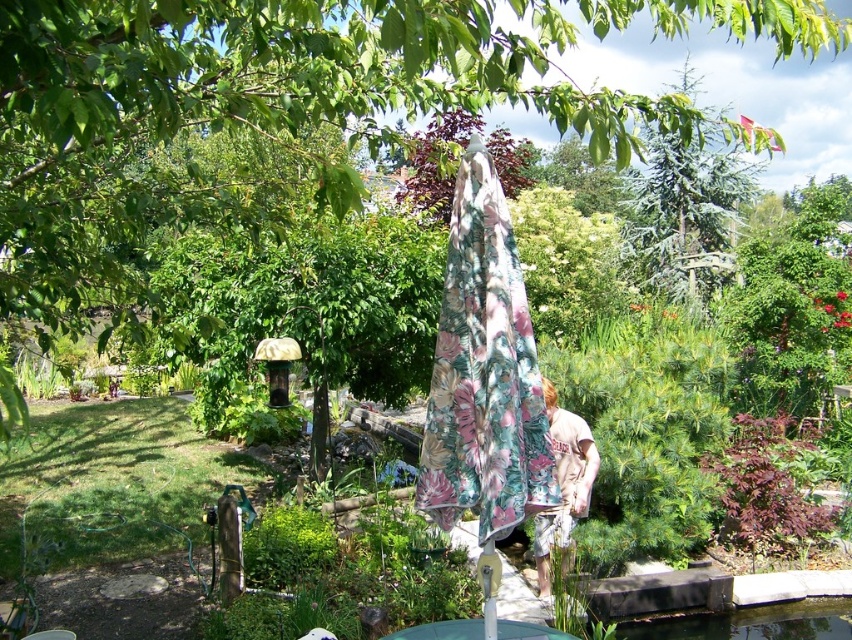
In the scene shown: Is green leafy tree at center bigger than floral fabric umbrella at center?

Yes, green leafy tree at center is bigger than floral fabric umbrella at center.

This screenshot has height=640, width=852. I want to click on green leafy tree at center, so click(x=285, y=100).

What do you see at coordinates (285, 100) in the screenshot?
I see `green leafy tree at center` at bounding box center [285, 100].

Find the location of `green leafy tree at center`. green leafy tree at center is located at coordinates (285, 100).

Between floral fabric umbrella at center and transparent glass pond at lower center, which one appears on the right side from the viewer's perspective?

Positioned to the right is transparent glass pond at lower center.

Who is more distant from viewer, (470, 307) or (770, 604)?

Point (770, 604)

I want to click on floral fabric umbrella at center, so click(x=484, y=381).

Does floral fabric umbrella at center appear on the right side of green textured pine tree at upper right?

Incorrect, floral fabric umbrella at center is not on the right side of green textured pine tree at upper right.

At what (x,y) coordinates should I click in order to perform the action: click on floral fabric umbrella at center. Please return your answer as a coordinate pair (x, y). Looking at the image, I should click on 484,381.

Locate an element on the screen. The image size is (852, 640). floral fabric umbrella at center is located at coordinates (484, 381).